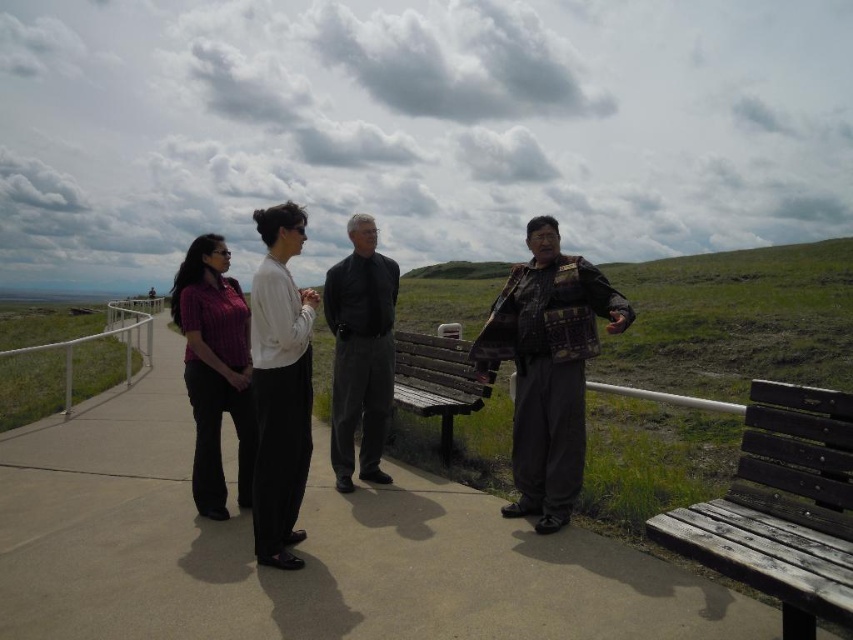
Can you confirm if wooden bench at center is positioned below dark gray fabric pants at center?

Yes, wooden bench at center is below dark gray fabric pants at center.

Who is more forward, (50,506) or (374,387)?

Point (50,506) is in front.

Which is in front, point (164, 616) or point (340, 381)?

Point (164, 616) is in front.

The image size is (853, 640). Find the location of `wooden bench at center`. wooden bench at center is located at coordinates (305, 548).

Is wooden bench at center wider than plaid fabric jacket at center?

A: No.

Describe the element at coordinates (305, 548) in the screenshot. The height and width of the screenshot is (640, 853). I see `wooden bench at center` at that location.

At what (x,y) coordinates should I click in order to perform the action: click on wooden bench at center. Please return your answer as a coordinate pair (x, y). Looking at the image, I should click on (305, 548).

What are the coordinates of `wooden bench at center` in the screenshot? It's located at tap(305, 548).

Is white matte shirt at center below dark brown wooden bench at center?

No.

Which is below, white matte shirt at center or dark brown wooden bench at center?

dark brown wooden bench at center

What do you see at coordinates (280, 387) in the screenshot? I see `white matte shirt at center` at bounding box center [280, 387].

Find the location of a particular element. This screenshot has height=640, width=853. white matte shirt at center is located at coordinates (280, 387).